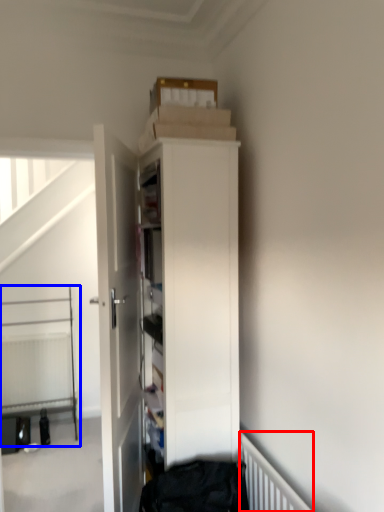
Question: Which object appears farthest to the camera in this image, radiator (highlighted by a red box) or bed (highlighted by a blue box)?

Choices:
 (A) radiator
 (B) bed

Answer: (B)